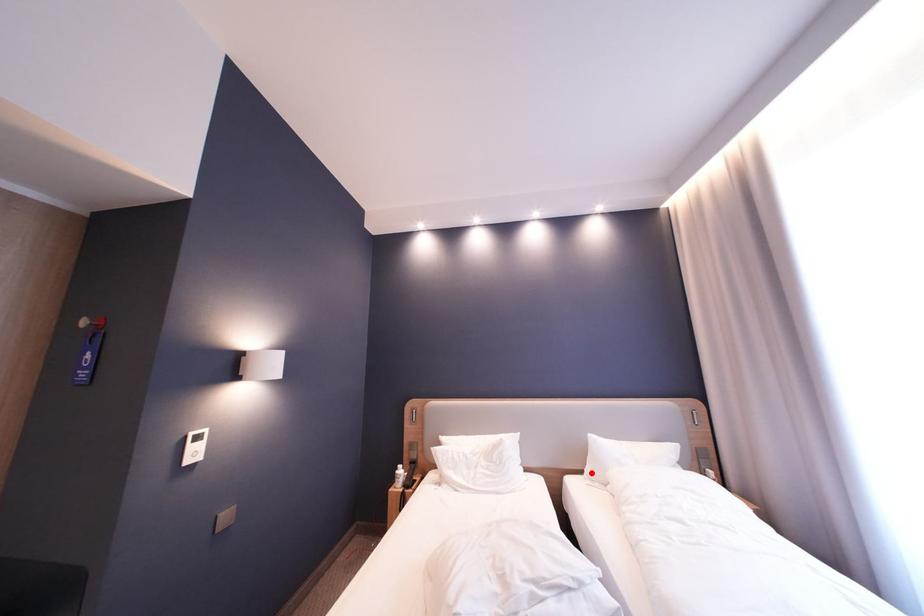
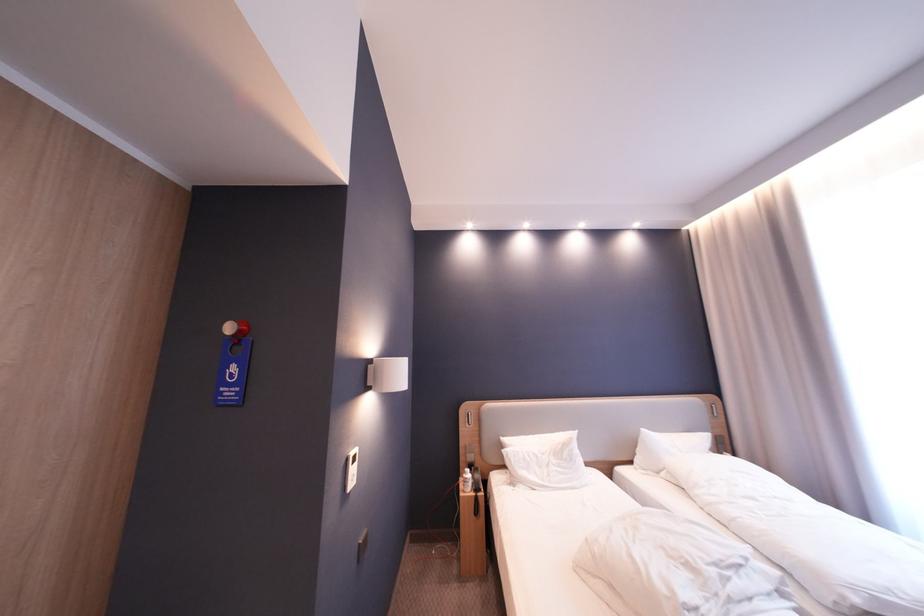
The point at the highlighted location is marked in the first image. Where is the corresponding point in the second image?

(641, 464)